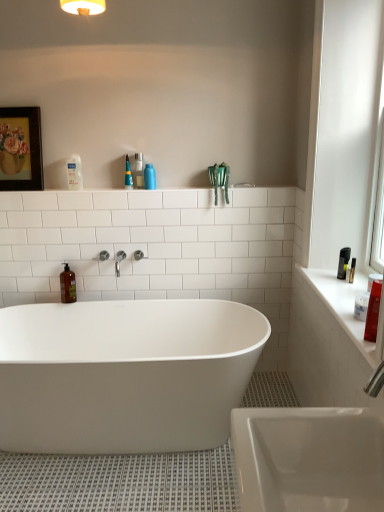
Identify the location of free space to the left of translucent plastic spray bottle at upper center, marked as the second cleaning product in a back-to-front arrangement. Image resolution: width=384 pixels, height=512 pixels. (114, 187).